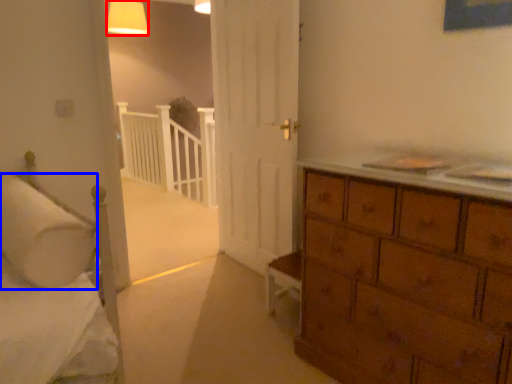
Question: Which point is further to the camera, lighting (highlighted by a red box) or pillow (highlighted by a blue box)?

Choices:
 (A) lighting
 (B) pillow

Answer: (A)